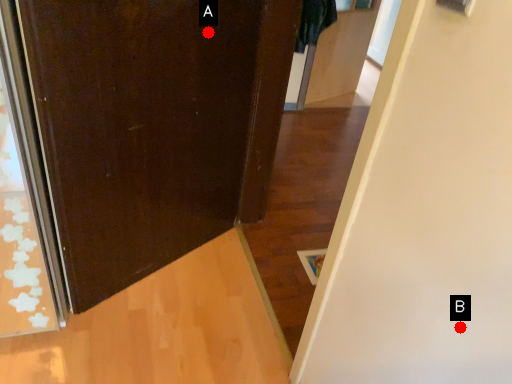
Question: Two points are circled on the image, labeled by A and B beside each circle. Among these points, which one is farthest from the camera?

Choices:
 (A) A is further
 (B) B is further

Answer: (A)